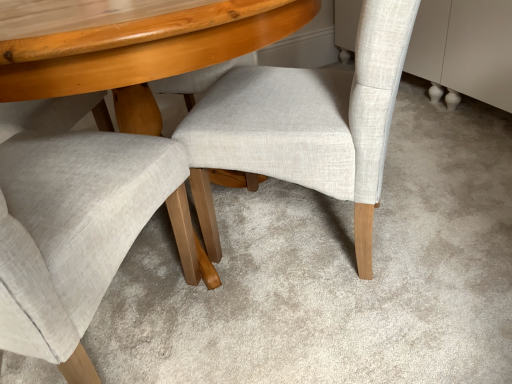
Question: From a real-world perspective, relative to light gray fabric chair at center, which ranks as the 1th chair in left-to-right order, is light beige fabric chair at center, which appears as the second chair when viewed from the left, vertically above or below?

Choices:
 (A) below
 (B) above

Answer: (A)

Question: Is point (372, 200) closer or farther from the camera than point (159, 193)?

Choices:
 (A) farther
 (B) closer

Answer: (A)

Question: Visually, is light beige fabric chair at center, marked as the first chair in a right-to-left arrangement, positioned to the left or to the right of light gray fabric chair at center, the second chair viewed from the right?

Choices:
 (A) left
 (B) right

Answer: (B)

Question: Based on their sizes in the image, would you say light gray fabric chair at center, which ranks as the 1th chair in left-to-right order, is bigger or smaller than light beige fabric chair at center, marked as the first chair in a right-to-left arrangement?

Choices:
 (A) small
 (B) big

Answer: (B)

Question: Would you say light gray fabric chair at center, the second chair viewed from the right, is inside or outside light beige fabric chair at center, which appears as the second chair when viewed from the left?

Choices:
 (A) outside
 (B) inside

Answer: (A)

Question: Looking at their shapes, would you say light gray fabric chair at center, which ranks as the 1th chair in left-to-right order, is wider or thinner than light beige fabric chair at center, which appears as the second chair when viewed from the left?

Choices:
 (A) thin
 (B) wide

Answer: (B)

Question: Considering their positions, is light gray fabric chair at center, the second chair viewed from the right, located in front of or behind light beige fabric chair at center, marked as the first chair in a right-to-left arrangement?

Choices:
 (A) behind
 (B) front

Answer: (B)